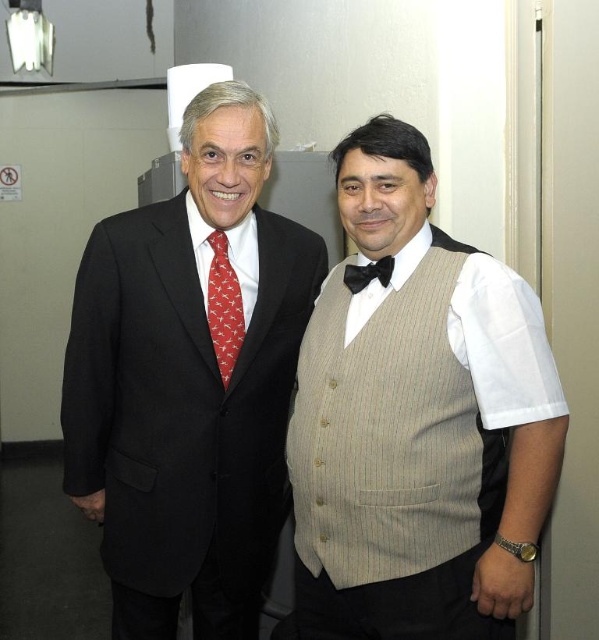
Which is above, matte black suit at left or black satin bow tie at center?

black satin bow tie at center is above.

Can you confirm if matte black suit at left is wider than black satin bow tie at center?

Indeed, matte black suit at left has a greater width compared to black satin bow tie at center.

Is point (214, 385) closer to camera compared to point (388, 268)?

No.

This screenshot has height=640, width=599. I want to click on matte black suit at left, so click(x=189, y=381).

Which is behind, point (482, 368) or point (416, 401)?

Point (416, 401)

Is beige striped vest at center taller than tan pinstripe vest at center?

Correct, beige striped vest at center is much taller as tan pinstripe vest at center.

Who is more forward, (317, 426) or (452, 426)?

Point (452, 426) is in front.

Image resolution: width=599 pixels, height=640 pixels. In order to click on beige striped vest at center in this screenshot , I will do `click(418, 420)`.

Looking at this image, who is lower down, tan pinstripe vest at center or red silk tie at center?

tan pinstripe vest at center

Is tan pinstripe vest at center positioned behind red silk tie at center?

That is False.

Which is in front, point (418, 301) or point (240, 292)?

Point (418, 301)

This screenshot has width=599, height=640. Identify the location of tan pinstripe vest at center. (389, 435).